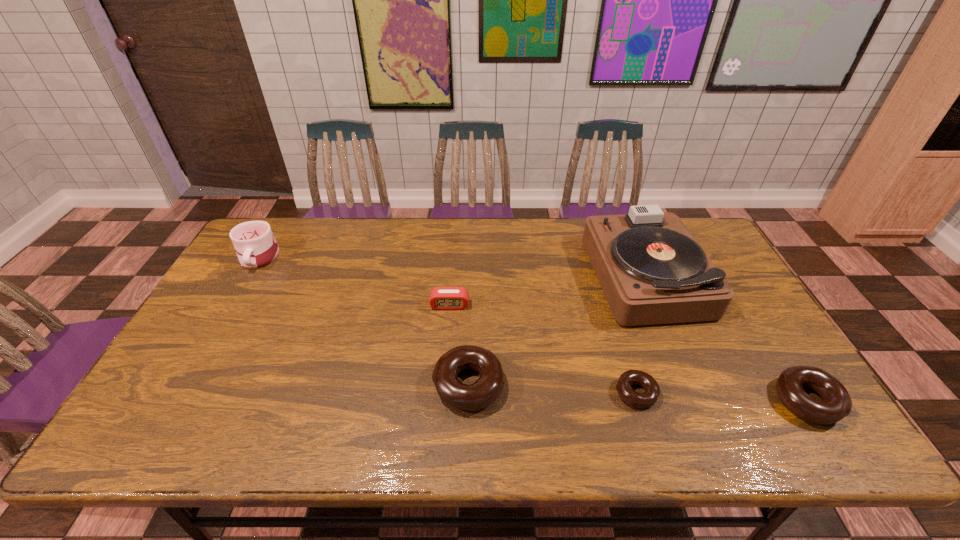
The height and width of the screenshot is (540, 960). Find the location of `free space located 0.220m on the right of the shortest object`. free space located 0.220m on the right of the shortest object is located at coordinates (747, 393).

Identify the location of free region located 0.080m on the left of the second shortest doughnut. The image size is (960, 540). (743, 401).

Find the location of a particular element. free region located 0.090m on the side with the handle of the mug is located at coordinates (237, 294).

At what (x,y) coordinates should I click in order to perform the action: click on vacant space situated 0.160m on the left of the tallest object. Please return your answer as a coordinate pair (x, y). Looking at the image, I should click on (540, 275).

Locate an element on the screen. The image size is (960, 540). vacant point located on the front-facing side of the alarm clock is located at coordinates [444, 374].

I want to click on mug situated at the far edge, so click(x=256, y=247).

This screenshot has width=960, height=540. In order to click on record player that is at the far edge in this screenshot , I will do `click(651, 269)`.

Find the location of a particular element. object present at the left edge is located at coordinates (256, 247).

Locate an element on the screen. This screenshot has height=540, width=960. doughnut located at the right edge is located at coordinates (836, 404).

Where is `record player that is positioned at the right edge`? The image size is (960, 540). record player that is positioned at the right edge is located at coordinates (651, 269).